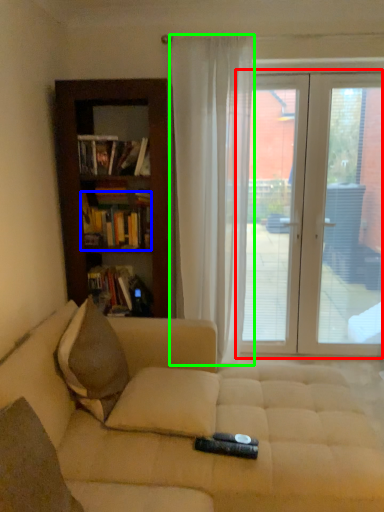
Question: Which object is positioned closest to door (highlighted by a red box)? Select from book (highlighted by a blue box) and curtain (highlighted by a green box).

Choices:
 (A) book
 (B) curtain

Answer: (B)